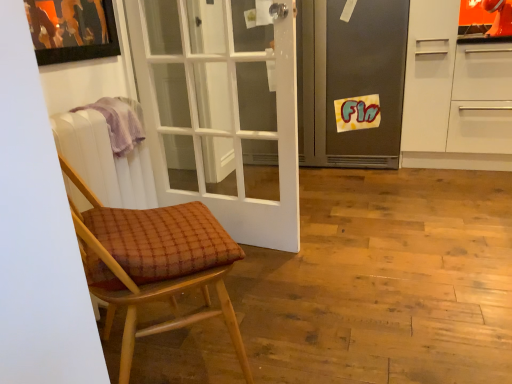
Question: From a real-world perspective, is brown woven cushion at left positioned over purple cloth at left based on gravity?

Choices:
 (A) no
 (B) yes

Answer: (A)

Question: From the image's perspective, does brown woven cushion at left appear lower than purple cloth at left?

Choices:
 (A) yes
 (B) no

Answer: (A)

Question: Is brown woven cushion at left positioned in front of purple cloth at left?

Choices:
 (A) no
 (B) yes

Answer: (B)

Question: Is purple cloth at left surrounded by brown woven cushion at left?

Choices:
 (A) no
 (B) yes

Answer: (A)

Question: Is brown woven cushion at left placed right next to purple cloth at left?

Choices:
 (A) yes
 (B) no

Answer: (B)

Question: Does brown woven cushion at left have a lesser width compared to purple cloth at left?

Choices:
 (A) yes
 (B) no

Answer: (B)

Question: From a real-world perspective, is metallic gray refrigerator at center physically below white plastic radiator at left?

Choices:
 (A) yes
 (B) no

Answer: (B)

Question: Is metallic gray refrigerator at center bigger than white plastic radiator at left?

Choices:
 (A) no
 (B) yes

Answer: (B)

Question: Considering the relative positions of metallic gray refrigerator at center and white plastic radiator at left in the image provided, is metallic gray refrigerator at center to the left of white plastic radiator at left from the viewer's perspective?

Choices:
 (A) yes
 (B) no

Answer: (B)

Question: Is the depth of metallic gray refrigerator at center less than that of white plastic radiator at left?

Choices:
 (A) yes
 (B) no

Answer: (B)

Question: Does metallic gray refrigerator at center lie behind white plastic radiator at left?

Choices:
 (A) yes
 (B) no

Answer: (A)

Question: Does metallic gray refrigerator at center have a greater height compared to white plastic radiator at left?

Choices:
 (A) no
 (B) yes

Answer: (B)

Question: From the image's perspective, is brown woven cushion at left under white plastic radiator at left?

Choices:
 (A) no
 (B) yes

Answer: (B)